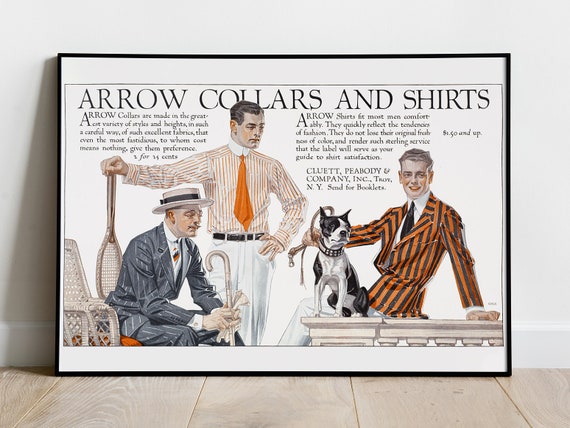
You are a GUI agent. You are given a task and a screenshot of the screen. Output one action in this format:
    pyautogui.click(x=<x>, y=<y>)
    Task: Click on the chair
    The width and height of the screenshot is (570, 428).
    Given the screenshot: What is the action you would take?
    pyautogui.click(x=89, y=312)